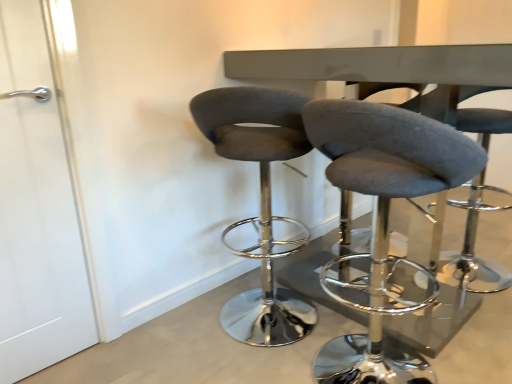
Question: From the image's perspective, is white matte door at left beneath gray fabric stool at center, positioned as the 2th chair in right-to-left order?

Choices:
 (A) yes
 (B) no

Answer: (B)

Question: Is white matte door at left positioned far away from gray fabric stool at center, positioned as the 2th chair in right-to-left order?

Choices:
 (A) no
 (B) yes

Answer: (B)

Question: Considering the relative sizes of white matte door at left and gray fabric stool at center, the second chair when ordered from left to right, in the image provided, is white matte door at left shorter than gray fabric stool at center, the second chair when ordered from left to right,?

Choices:
 (A) no
 (B) yes

Answer: (A)

Question: Does white matte door at left have a greater height compared to gray fabric stool at center, the second chair when ordered from left to right?

Choices:
 (A) no
 (B) yes

Answer: (B)

Question: From a real-world perspective, is white matte door at left physically above gray fabric stool at center, positioned as the 2th chair in right-to-left order?

Choices:
 (A) no
 (B) yes

Answer: (B)

Question: Is white matte door at left smaller than gray fabric stool at center, the second chair when ordered from left to right?

Choices:
 (A) yes
 (B) no

Answer: (A)

Question: Can you confirm if velvet grey stool at center, which is the 3th chair from left to right, is taller than velvet grey stool at center, marked as the first chair in a left-to-right arrangement?

Choices:
 (A) no
 (B) yes

Answer: (A)

Question: Is velvet grey stool at center, which is the 1th chair in right-to-left order, positioned beyond the bounds of velvet grey stool at center, marked as the first chair in a left-to-right arrangement?

Choices:
 (A) yes
 (B) no

Answer: (A)

Question: Does velvet grey stool at center, which is the 3th chair from left to right, lie in front of velvet grey stool at center, marked as the first chair in a left-to-right arrangement?

Choices:
 (A) yes
 (B) no

Answer: (B)

Question: Can you confirm if velvet grey stool at center, which is the 3th chair from left to right, is thinner than velvet grey stool at center, marked as the first chair in a left-to-right arrangement?

Choices:
 (A) no
 (B) yes

Answer: (B)

Question: Is velvet grey stool at center, which is the 3th chair from left to right, facing away from velvet grey stool at center, positioned as the third chair in right-to-left order?

Choices:
 (A) no
 (B) yes

Answer: (A)

Question: Is velvet grey stool at center, which is the 1th chair in right-to-left order, bigger than velvet grey stool at center, positioned as the third chair in right-to-left order?

Choices:
 (A) no
 (B) yes

Answer: (A)

Question: From a real-world perspective, is gray fabric stool at center, the second chair when ordered from left to right, on white matte door at left?

Choices:
 (A) yes
 (B) no

Answer: (B)